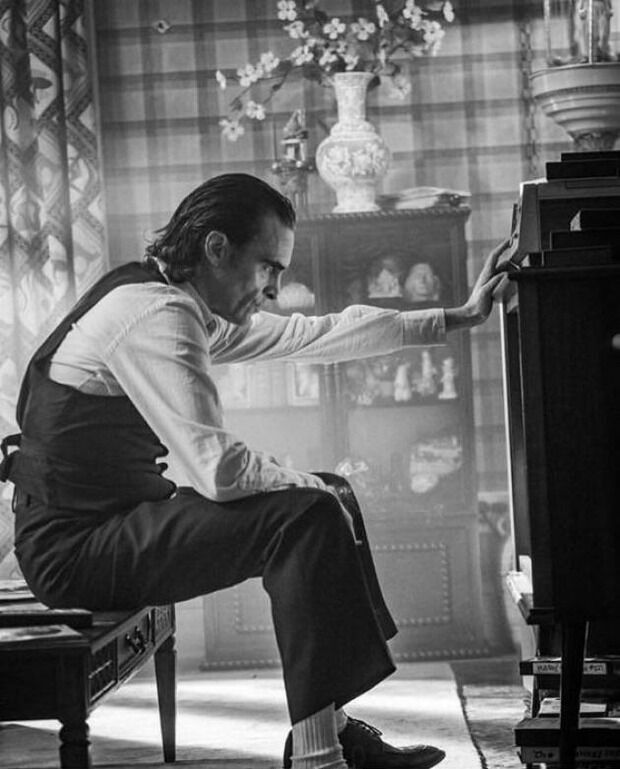
Identify the location of wall. pos(184,158).